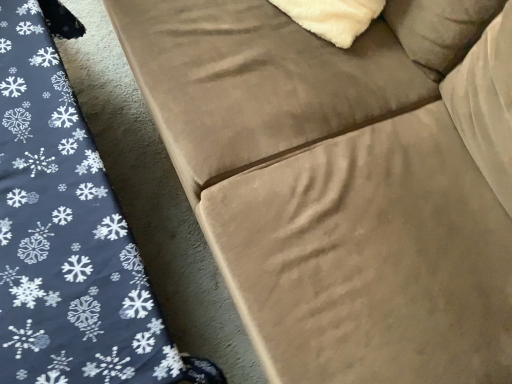
What do you see at coordinates (68, 232) in the screenshot? This screenshot has width=512, height=384. I see `blue snowflake-patterned fabric at left` at bounding box center [68, 232].

Find the location of a particular element. The image size is (512, 384). blue snowflake-patterned fabric at left is located at coordinates point(68,232).

What is the approximate height of blue snowflake-patterned fabric at left?

The height of blue snowflake-patterned fabric at left is 11.21 inches.

Measure the distance between point (77, 278) and camera.

Point (77, 278) and camera are 28.86 inches apart.

Locate an element on the screen. Image resolution: width=512 pixels, height=384 pixels. blue snowflake-patterned fabric at left is located at coordinates (68, 232).